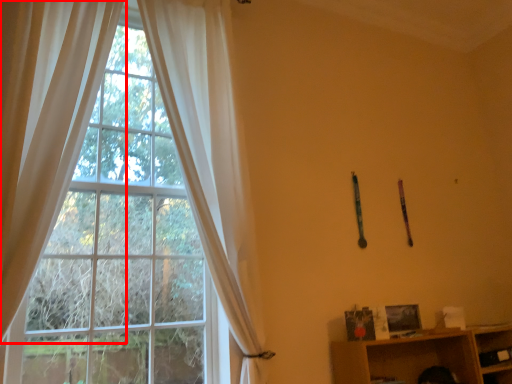
Question: From the image's perspective, considering the relative positions of curtain (annotated by the red box) and curtain in the image provided, where is curtain (annotated by the red box) located with respect to the staircase?

Choices:
 (A) below
 (B) above

Answer: (A)